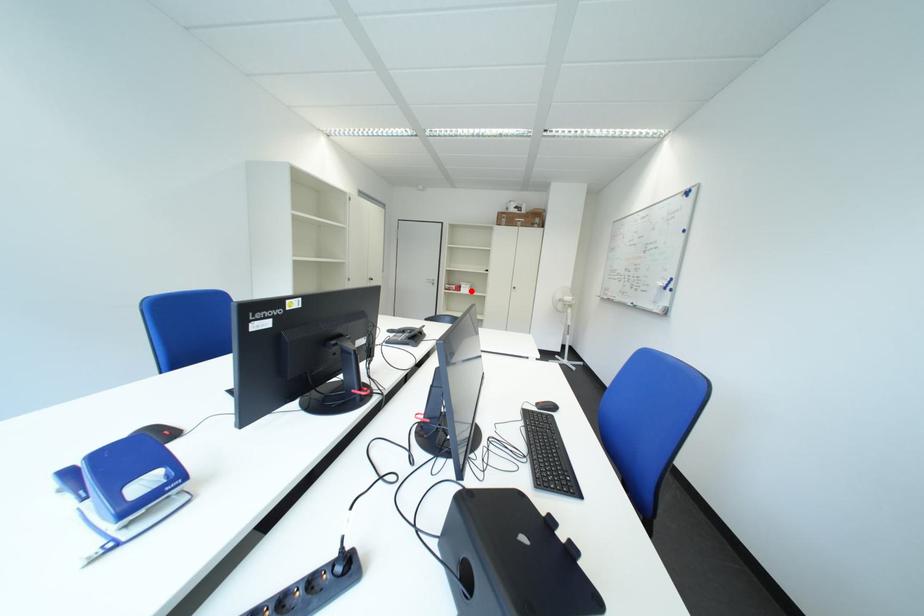
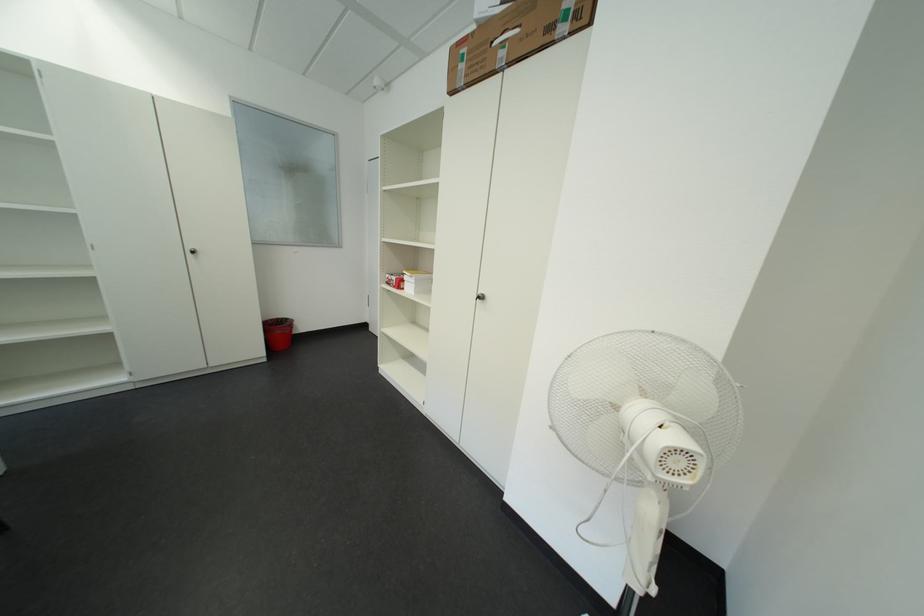
Where in the second image is the point corresponding to the highlighted location from the first image?

(411, 286)